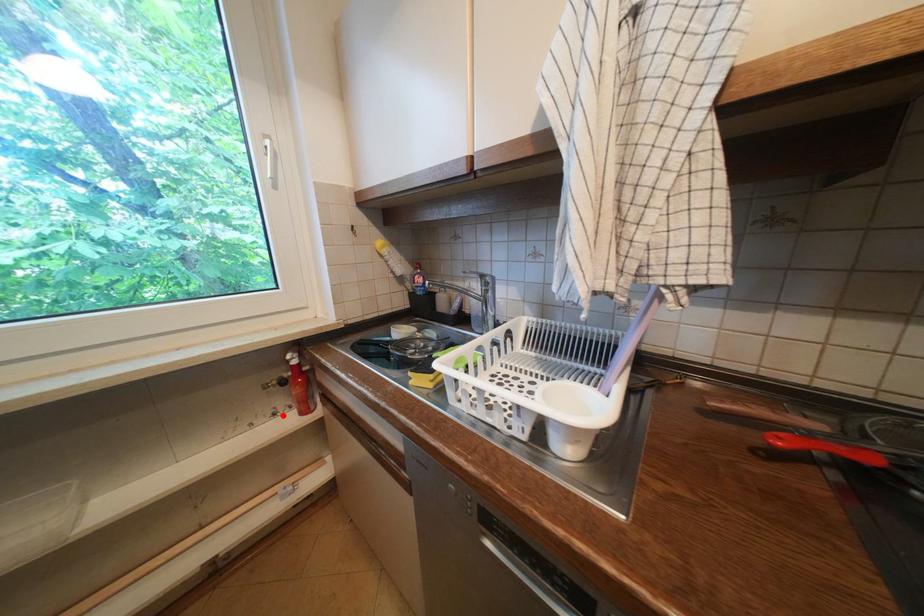
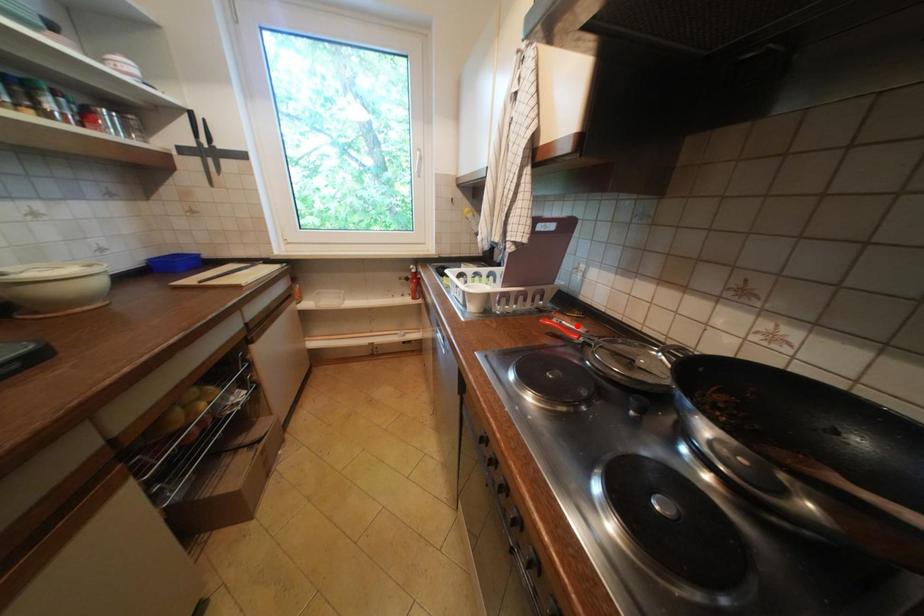
I am providing you with two images of the same scene from different viewpoints. A red point is marked on the first image and another point is marked on the second image. Is the red point in image1 aligned with the point shown in image2?

No